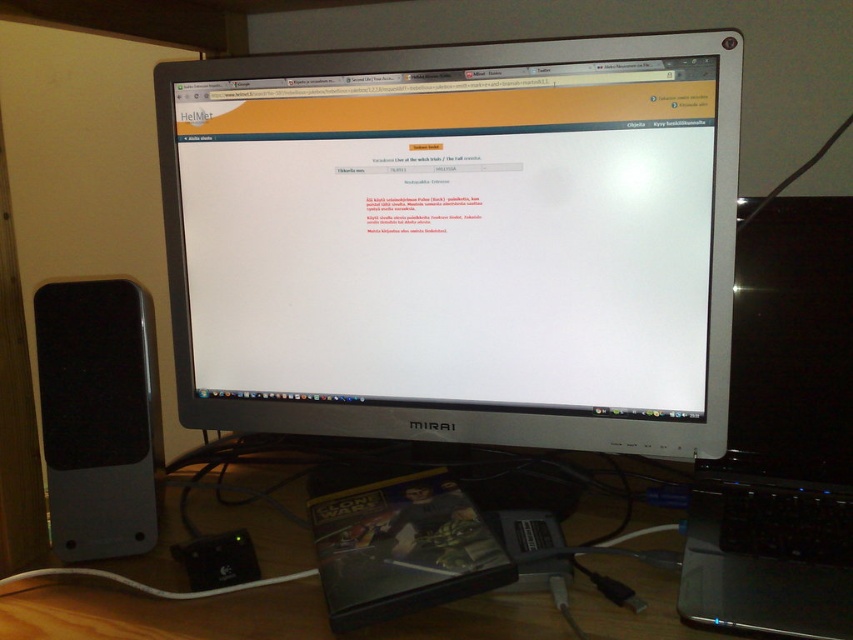
You are setting up a new desk and want to place the silver metallic monitor at center and the black glossy laptop at right. Given that the desk has limited vertical space, which device should you prioritize placing first to ensure they both fit?

The silver metallic monitor at center is taller than the black glossy laptop at right, so you should prioritize placing the silver metallic monitor at center first to ensure there is enough vertical space for both devices.

You are setting up a new workspace and want to place a plant between the silver metallic monitor at center and the black matte speaker at left. Based on their positions, where should you place the plant?

The silver metallic monitor at center is to the right of the black matte speaker at left, so you should place the plant between them, to the right of the black matte speaker at left and to the left of the silver metallic monitor at center.